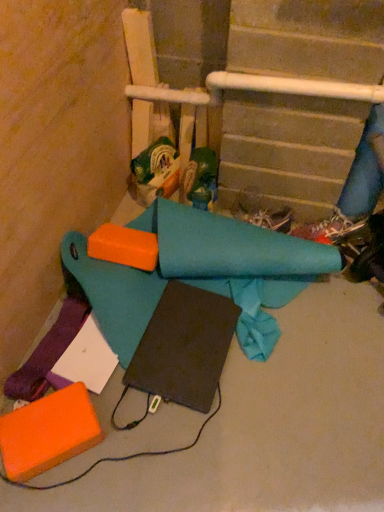
Question: Considering the relative sizes of green cardboard box at center, the first toy from the left, and blue fabric at right, which is the first fabric in right-to-left order, in the image provided, is green cardboard box at center, the first toy from the left, thinner than blue fabric at right, which is the first fabric in right-to-left order,?

Choices:
 (A) no
 (B) yes

Answer: (A)

Question: Is green cardboard box at center, the second toy in the right-to-left sequence, facing towards blue fabric at right, arranged as the third fabric when viewed from the left?

Choices:
 (A) no
 (B) yes

Answer: (A)

Question: Can you confirm if green cardboard box at center, the second toy in the right-to-left sequence, is shorter than blue fabric at right, which is the first fabric in right-to-left order?

Choices:
 (A) no
 (B) yes

Answer: (B)

Question: Is green cardboard box at center, the second toy in the right-to-left sequence, bigger than blue fabric at right, which is the first fabric in right-to-left order?

Choices:
 (A) yes
 (B) no

Answer: (B)

Question: Is green cardboard box at center, the first toy from the left, to the right of blue fabric at right, which is the first fabric in right-to-left order, from the viewer's perspective?

Choices:
 (A) no
 (B) yes

Answer: (A)

Question: From the image's perspective, is green cardboard box at center, the first toy from the left, beneath blue fabric at right, which is the first fabric in right-to-left order?

Choices:
 (A) yes
 (B) no

Answer: (B)

Question: Is black matte notebook at center further to the viewer compared to teal fabric cone at center, marked as the second toy in a left-to-right arrangement?

Choices:
 (A) yes
 (B) no

Answer: (B)

Question: Is black matte notebook at center completely or partially outside of teal fabric cone at center, marked as the second toy in a left-to-right arrangement?

Choices:
 (A) no
 (B) yes

Answer: (B)

Question: Is black matte notebook at center shorter than teal fabric cone at center, marked as the second toy in a left-to-right arrangement?

Choices:
 (A) yes
 (B) no

Answer: (A)

Question: Is black matte notebook at center looking in the opposite direction of teal fabric cone at center, placed as the first toy when sorted from right to left?

Choices:
 (A) no
 (B) yes

Answer: (A)

Question: Is black matte notebook at center wider than teal fabric cone at center, placed as the first toy when sorted from right to left?

Choices:
 (A) no
 (B) yes

Answer: (B)

Question: Can you confirm if black matte notebook at center is thinner than teal fabric cone at center, placed as the first toy when sorted from right to left?

Choices:
 (A) yes
 (B) no

Answer: (B)

Question: Is purple fabric at lower left, which ranks as the 1th fabric in left-to-right order, shorter than shiny black shoe at lower right?

Choices:
 (A) yes
 (B) no

Answer: (A)